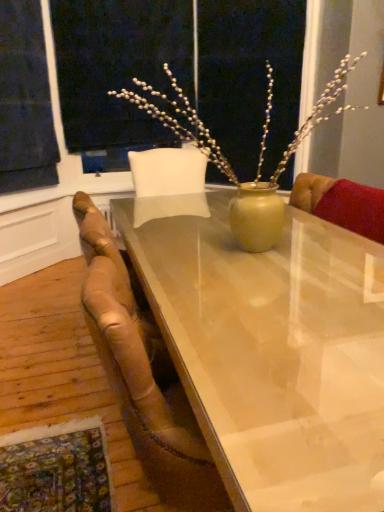
Locate an element on the screen. leather at left is located at coordinates (143, 373).

From a real-world perspective, does leather at left stand above translucent glass table at center?

Yes, from a real-world perspective, leather at left is on top of translucent glass table at center.

Can you confirm if leather at left is bigger than translucent glass table at center?

No.

Is leather at left thinner than translucent glass table at center?

Correct, the width of leather at left is less than that of translucent glass table at center.

From a real-world perspective, is translucent glass table at center above or below dark blue fabric at upper left?

Clearly, from a real-world perspective, translucent glass table at center is below dark blue fabric at upper left.

Which point is more forward, (359, 244) or (6, 76)?

The point (359, 244) is in front.

Where is `table that appears on the right of dark blue fabric at upper left`? The height and width of the screenshot is (512, 384). table that appears on the right of dark blue fabric at upper left is located at coordinates (271, 349).

Is translucent glass table at center facing towards dark blue fabric at upper left?

No, translucent glass table at center does not turn towards dark blue fabric at upper left.

From the image's perspective, is leather at left positioned above or below dark blue fabric at upper left?

leather at left is below dark blue fabric at upper left.

I want to click on curtain on the left of leather at left, so (x=25, y=100).

Is leather at left further to the viewer compared to dark blue fabric at upper left?

No, leather at left is closer to the camera.

Considering the points (127, 405) and (13, 98), which point is in front, point (127, 405) or point (13, 98)?

Positioned in front is point (127, 405).

Can you confirm if dark blue fabric at upper left is smaller than leather at left?

Yes.

What's the angular difference between dark blue fabric at upper left and leather at left's facing directions?

dark blue fabric at upper left and leather at left are facing 45.3 degrees away from each other.

From a real-world perspective, relative to leather at left, is dark blue fabric at upper left vertically above or below?

Clearly, from a real-world perspective, dark blue fabric at upper left is above leather at left.

Between translucent glass table at center and leather at left, which one appears on the left side from the viewer's perspective?

Positioned to the left is leather at left.

How different are the orientations of translucent glass table at center and leather at left in degrees?

translucent glass table at center and leather at left are facing 90.6 degrees away from each other.

Looking at their sizes, would you say translucent glass table at center is wider or thinner than leather at left?

Considering their sizes, translucent glass table at center looks broader than leather at left.

In terms of height, does translucent glass table at center look taller or shorter compared to leather at left?

Considering their sizes, translucent glass table at center has less height than leather at left.

In the scene shown: Is dark blue fabric at upper left inside the boundaries of translucent glass table at center, or outside?

dark blue fabric at upper left cannot be found inside translucent glass table at center.

From a real-world perspective, which object stands above the other?

dark blue fabric at upper left is physically above.

Image resolution: width=384 pixels, height=512 pixels. I want to click on curtain that appears above the translucent glass table at center (from a real-world perspective), so click(x=25, y=100).

Would you say dark blue fabric at upper left is a long distance from translucent glass table at center?

Yes, dark blue fabric at upper left and translucent glass table at center are located far from each other.

I want to click on table that is below the leather at left (from the image's perspective), so click(x=271, y=349).

You are a GUI agent. You are given a task and a screenshot of the screen. Output one action in this format:
    pyautogui.click(x=<x>, y=<y>)
    Task: Click on the curtain behind the translucent glass table at center
    The image size is (384, 512).
    Given the screenshot: What is the action you would take?
    pyautogui.click(x=25, y=100)

Consider the image. Estimate the real-world distances between objects in this image. Which object is closer to dark blue fabric at upper left, leather at left or translucent glass table at center?

leather at left lies closer to dark blue fabric at upper left than the other object.

Based on their spatial positions, is dark blue fabric at upper left or translucent glass table at center closer to leather at left?

translucent glass table at center is positioned closer to the anchor leather at left.

When comparing their distances from translucent glass table at center, does dark blue fabric at upper left or leather at left seem further?

dark blue fabric at upper left.

Based on their spatial positions, is leather at left or dark blue fabric at upper left further from translucent glass table at center?

Based on the image, dark blue fabric at upper left appears to be further to translucent glass table at center.

Which object lies nearer to the anchor point leather at left, translucent glass table at center or dark blue fabric at upper left?

Among the two, translucent glass table at center is located nearer to leather at left.

Based on their spatial positions, is translucent glass table at center or leather at left further from dark blue fabric at upper left?

translucent glass table at center lies further to dark blue fabric at upper left than the other object.

Identify the location of chair between translucent glass table at center and dark blue fabric at upper left from front to back. This screenshot has width=384, height=512. tap(143, 373).